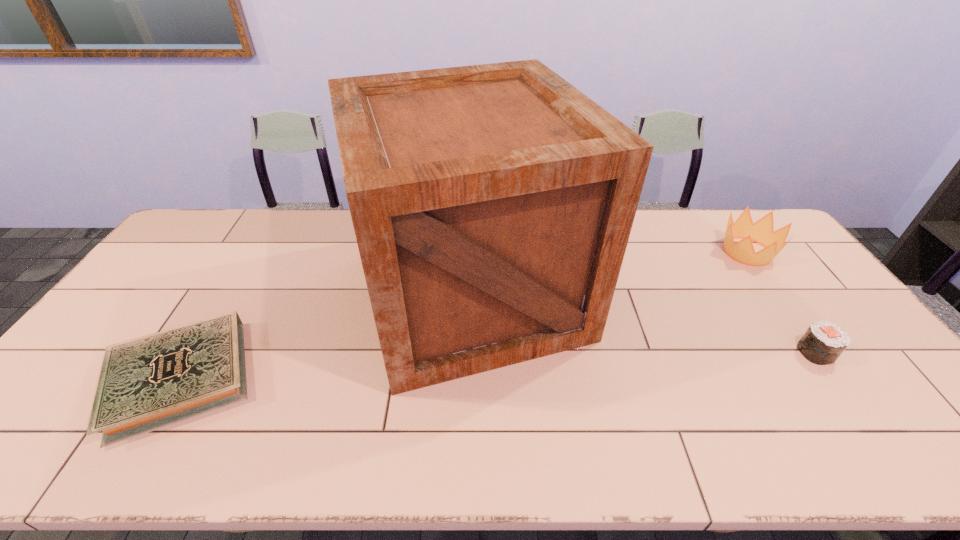
The width and height of the screenshot is (960, 540). Find the location of `box`. box is located at coordinates (492, 204).

Identify the location of the tallest object. The width and height of the screenshot is (960, 540). (492, 204).

At what (x,y) coordinates should I click in order to perform the action: click on crown. Please return your answer as a coordinate pair (x, y). Image resolution: width=960 pixels, height=540 pixels. Looking at the image, I should click on (762, 232).

I want to click on the second shortest object, so click(x=823, y=342).

Where is `hardback book`? hardback book is located at coordinates (147, 383).

Locate an element on the screen. the leftmost object is located at coordinates (147, 383).

The width and height of the screenshot is (960, 540). What are the coordinates of `vacant space situated 0.120m on the left of the box` in the screenshot? It's located at (314, 294).

I want to click on vacant space located 0.300m on the left of the crown, so click(630, 252).

The width and height of the screenshot is (960, 540). What are the coordinates of `vacant position located on the back of the sushi` in the screenshot? It's located at (780, 301).

What are the coordinates of `blank space located on the back of the shortest object` in the screenshot? It's located at (252, 259).